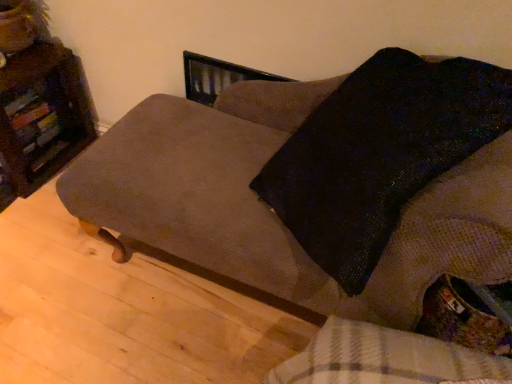
Question: Considering the relative sizes of suede-like brown couch at center and wooden bookshelf at left in the image provided, is suede-like brown couch at center smaller than wooden bookshelf at left?

Choices:
 (A) yes
 (B) no

Answer: (B)

Question: Would you say suede-like brown couch at center is outside wooden bookshelf at left?

Choices:
 (A) yes
 (B) no

Answer: (A)

Question: From the image's perspective, is suede-like brown couch at center beneath wooden bookshelf at left?

Choices:
 (A) yes
 (B) no

Answer: (A)

Question: From a real-world perspective, is suede-like brown couch at center on wooden bookshelf at left?

Choices:
 (A) no
 (B) yes

Answer: (B)

Question: Could you tell me if suede-like brown couch at center is turned towards wooden bookshelf at left?

Choices:
 (A) yes
 (B) no

Answer: (B)

Question: From a real-world perspective, is suede-like brown couch at center below wooden bookshelf at left?

Choices:
 (A) yes
 (B) no

Answer: (B)

Question: Is wooden bookshelf at left wider than suede-like brown couch at center?

Choices:
 (A) no
 (B) yes

Answer: (A)

Question: Is wooden bookshelf at left not near suede-like brown couch at center?

Choices:
 (A) no
 (B) yes

Answer: (A)

Question: Is wooden bookshelf at left outside of suede-like brown couch at center?

Choices:
 (A) yes
 (B) no

Answer: (A)

Question: Can you confirm if wooden bookshelf at left is thinner than suede-like brown couch at center?

Choices:
 (A) yes
 (B) no

Answer: (A)

Question: Is wooden bookshelf at left beside suede-like brown couch at center?

Choices:
 (A) yes
 (B) no

Answer: (B)

Question: Is the position of wooden bookshelf at left more distant than that of suede-like brown couch at center?

Choices:
 (A) no
 (B) yes

Answer: (B)

Question: Considering the positions of suede-like brown couch at center and wooden bookshelf at left in the image, is suede-like brown couch at center wider or thinner than wooden bookshelf at left?

Choices:
 (A) wide
 (B) thin

Answer: (A)